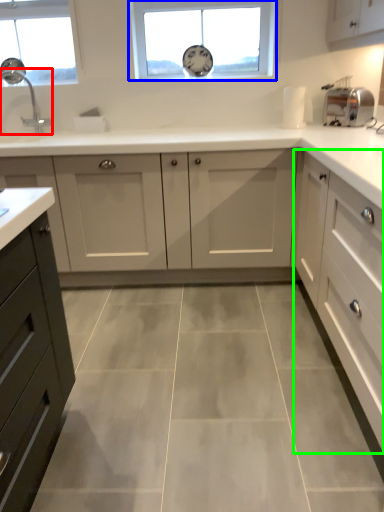
Question: Based on their relative distances, which object is nearer to tap (highlighted by a red box)? Choose from window (highlighted by a blue box) and cabinetry (highlighted by a green box).

Choices:
 (A) window
 (B) cabinetry

Answer: (A)